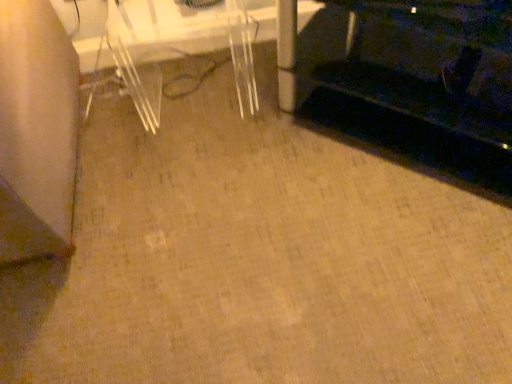
Question: Could you tell me if clear plastic table at center is facing black fabric couch at lower right?

Choices:
 (A) no
 (B) yes

Answer: (A)

Question: Does clear plastic table at center appear on the right side of black fabric couch at lower right?

Choices:
 (A) yes
 (B) no

Answer: (B)

Question: Is clear plastic table at center smaller than black fabric couch at lower right?

Choices:
 (A) no
 (B) yes

Answer: (B)

Question: Can you confirm if clear plastic table at center is thinner than black fabric couch at lower right?

Choices:
 (A) yes
 (B) no

Answer: (A)

Question: Is clear plastic table at center bigger than black fabric couch at lower right?

Choices:
 (A) yes
 (B) no

Answer: (B)

Question: From the image's perspective, is clear plastic table at center located beneath black fabric couch at lower right?

Choices:
 (A) yes
 (B) no

Answer: (B)

Question: Is black fabric couch at lower right located outside clear plastic table at center?

Choices:
 (A) no
 (B) yes

Answer: (B)

Question: From the image's perspective, does black fabric couch at lower right appear higher than clear plastic table at center?

Choices:
 (A) yes
 (B) no

Answer: (B)

Question: Does black fabric couch at lower right have a lesser height compared to clear plastic table at center?

Choices:
 (A) no
 (B) yes

Answer: (A)

Question: Is black fabric couch at lower right taller than clear plastic table at center?

Choices:
 (A) no
 (B) yes

Answer: (B)

Question: From the image's perspective, is black fabric couch at lower right located beneath clear plastic table at center?

Choices:
 (A) yes
 (B) no

Answer: (A)

Question: Considering the relative positions of black fabric couch at lower right and clear plastic table at center in the image provided, is black fabric couch at lower right in front of clear plastic table at center?

Choices:
 (A) no
 (B) yes

Answer: (B)

Question: In terms of size, does black fabric couch at lower right appear bigger or smaller than clear plastic table at center?

Choices:
 (A) small
 (B) big

Answer: (B)